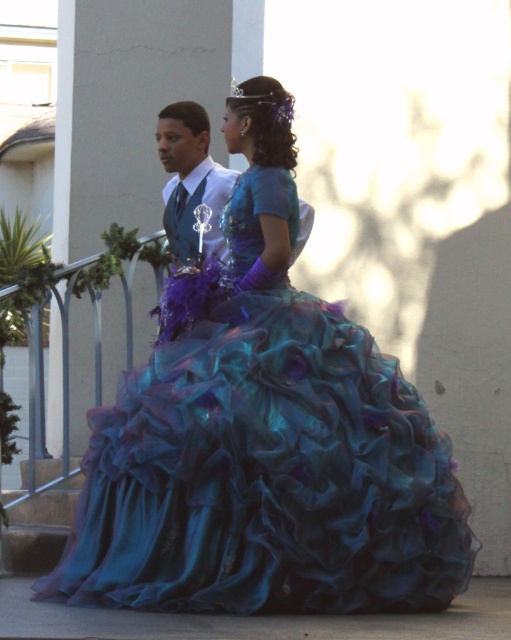
You are a photographer adjusting your camera settings to capture the two points in the image. Which of the two points, point (218, 330) or point (158, 321), appears closer to your camera lens?

Point (218, 330) is closer to the camera than point (158, 321), so it appears closer to the camera lens.

Where is the teal satin gown at center located in the image?

The teal satin gown at center is located at point (x=267, y=476).